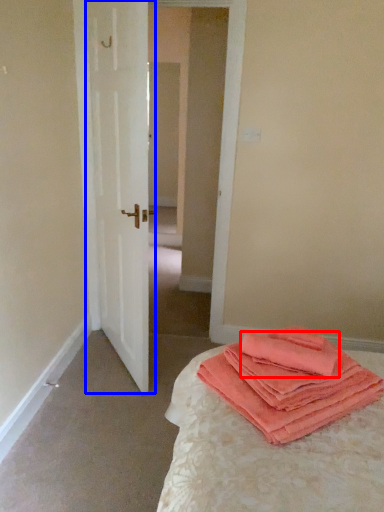
Question: Which object appears farthest to the camera in this image, cloth (highlighted by a red box) or door (highlighted by a blue box)?

Choices:
 (A) cloth
 (B) door

Answer: (B)